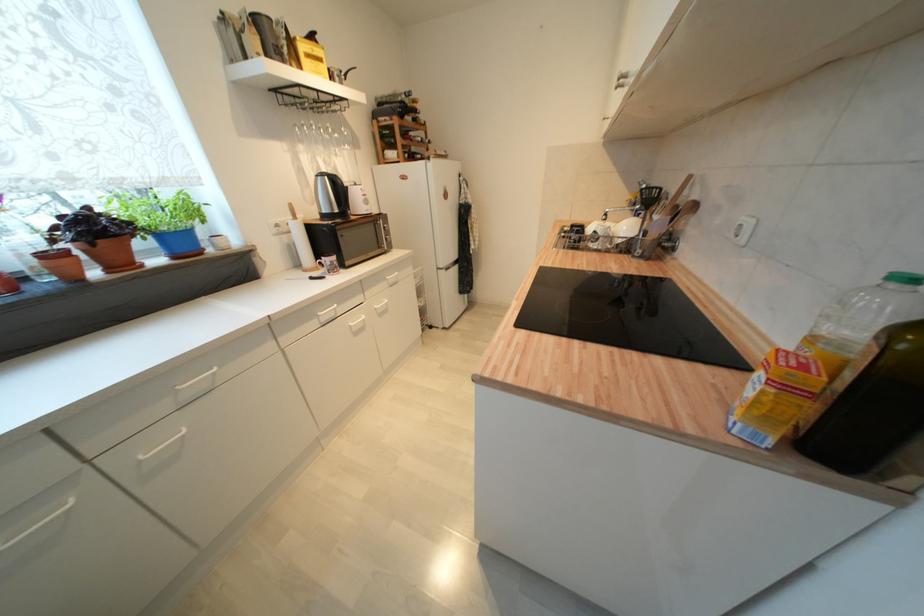
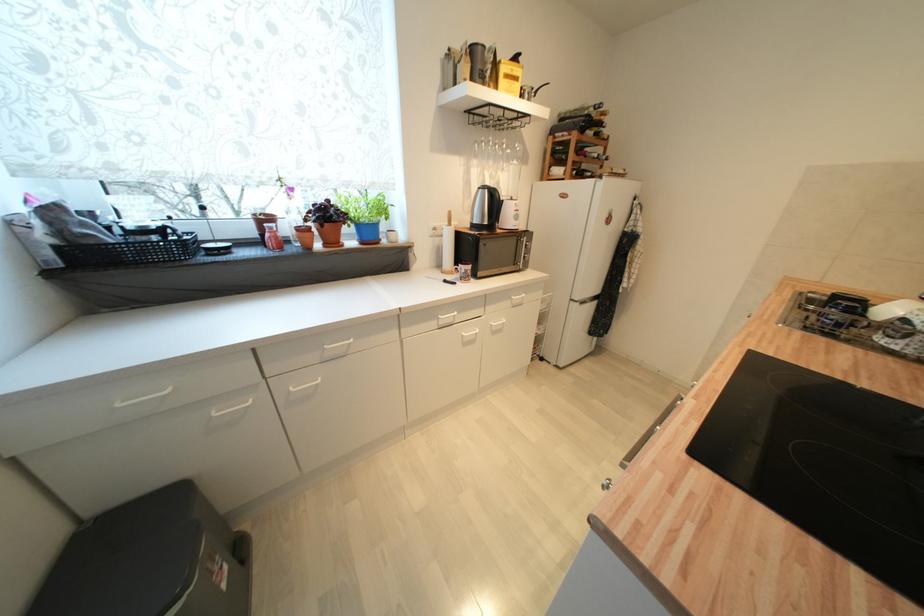
Question: The camera is either moving clockwise (left) or counter-clockwise (right) around the object. The first image is from the beginning of the video and the second image is from the end. Is the camera moving left or right when shooting the video?

Choices:
 (A) Left
 (B) Right

Answer: (B)